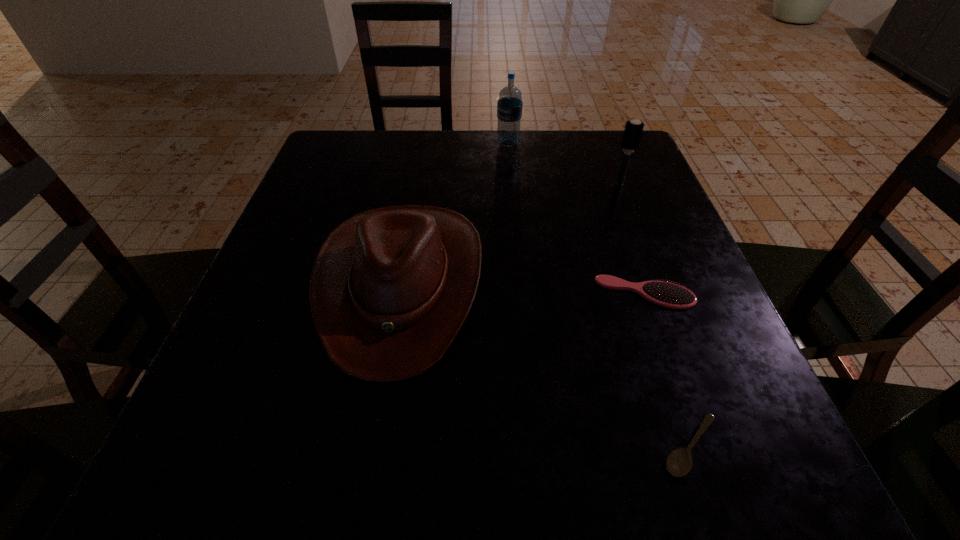
Identify the location of vacant region located on the right of the farthest object. The image size is (960, 540). (564, 143).

Identify the location of vacant position located 0.150m on the left of the fourth shortest object. point(544,184).

You are a GUI agent. You are given a task and a screenshot of the screen. Output one action in this format:
    pyautogui.click(x=<x>, y=<y>)
    Task: Click on the vacant space situated on the front-facing side of the cowboy hat
    
    Given the screenshot: What is the action you would take?
    pyautogui.click(x=377, y=423)

I want to click on vacant space located on the back of the fourth tallest object, so click(x=602, y=170).

You are a GUI agent. You are given a task and a screenshot of the screen. Output one action in this format:
    pyautogui.click(x=<x>, y=<y>)
    Task: Click on the free space located 0.350m on the back of the shortest object
    The width and height of the screenshot is (960, 540).
    Given the screenshot: What is the action you would take?
    pyautogui.click(x=623, y=247)

Where is `water bottle positioned at the far edge`? water bottle positioned at the far edge is located at coordinates click(509, 106).

Find the location of a particular element. Image resolution: width=960 pixels, height=540 pixels. hairbrush situated at the far edge is located at coordinates (633, 130).

This screenshot has width=960, height=540. In order to click on object present at the near edge in this screenshot , I will do `click(679, 462)`.

This screenshot has height=540, width=960. I want to click on object situated at the left edge, so (x=390, y=288).

Locate an element on the screen. Image resolution: width=960 pixels, height=540 pixels. soupspoon situated at the right edge is located at coordinates (679, 462).